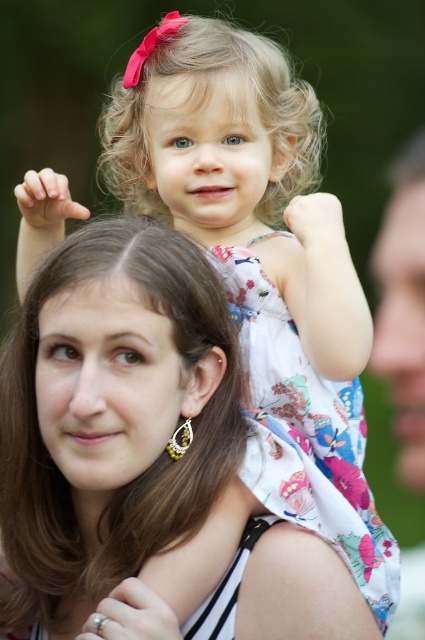
Question: Which point is closer to the camera?

Choices:
 (A) (418, 324)
 (B) (363, 304)
 (C) (144, 506)

Answer: (A)

Question: Can you confirm if smooth skin arm at upper center is positioned below light skin tone flesh at upper left?

Choices:
 (A) no
 (B) yes

Answer: (B)

Question: Can you confirm if brown smooth hair at center is positioned to the right of smooth skin face at right?

Choices:
 (A) no
 (B) yes

Answer: (A)

Question: Which point is closer to the camera?

Choices:
 (A) smooth skin face at right
 (B) smooth skin arm at upper center
 (C) light skin tone flesh at upper left
 (D) brown smooth hair at center

Answer: (D)

Question: Which point appears closest to the camera in this image?

Choices:
 (A) (299, 209)
 (B) (405, 394)
 (C) (62, 433)

Answer: (B)

Question: Can you confirm if smooth skin arm at upper center is positioned to the right of light skin tone flesh at upper left?

Choices:
 (A) yes
 (B) no

Answer: (A)